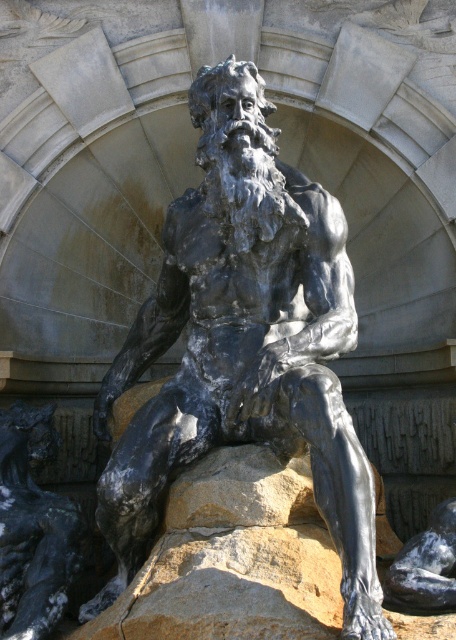
You are standing in front of the statue and want to touch both the shiny bronze statue at center and the shiny black stone statue at center. Which one can you reach first without moving your position?

The shiny bronze statue at center is closer to the viewer than the shiny black stone statue at center, so you can reach it first without moving.

You are an art conservator assessing the placement of the shiny bronze statue at center and the shiny black stone figure at lower left. Which object is located to the right of the other?

The shiny bronze statue at center is positioned on the right side of the shiny black stone figure at lower left.

You are an art conservator assessing the spatial arrangement of the statue. Considering the shiny black stone figure at lower left and the shiny black stone statue at center, which one appears larger in the image?

The shiny black stone figure at lower left is much taller than the shiny black stone statue at center, so it appears larger in the image.